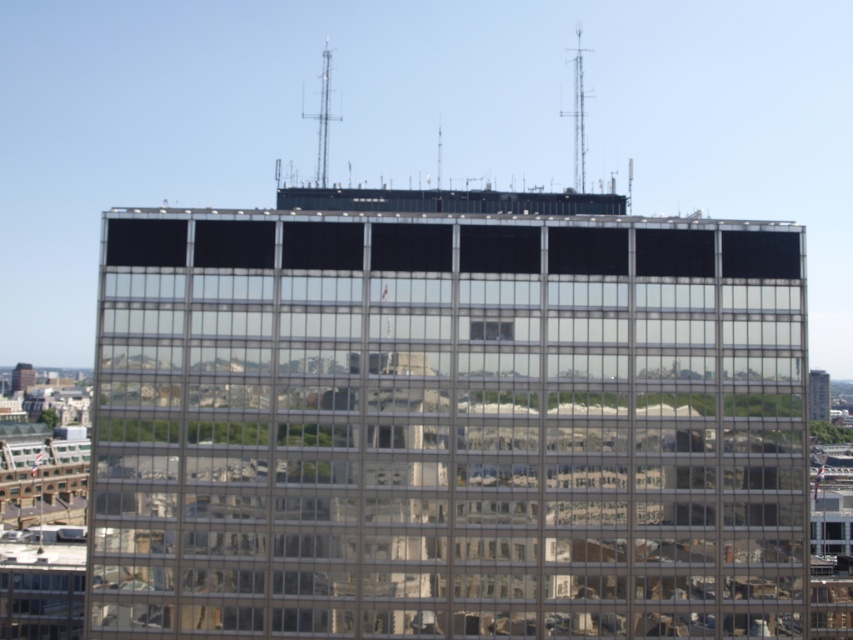
You are standing in front of the modern glass building and notice a point marked at coordinates (577,115). What object does this point correspond to?

The point at coordinates (577,115) corresponds to the metallic antenna at top right.

You are an urban planner reviewing the building design. The metallic antenna at top right and the matte glass tower at lower left are part of the proposed structure. Which of these two components is bigger in size according to the design specifications?

The metallic antenna at top right has a larger size compared to the matte glass tower at lower left according to the design specifications.

Consider the image. You are an urban planner analyzing the layout of this building. Given the positions of the metallic antenna at top right and the matte glass tower at lower left, which one is positioned further to the east if the building faces north?

The metallic antenna at top right is positioned further to the east because it is to the right of the matte glass tower at lower left, and since the building faces north, right would correspond to the east direction.